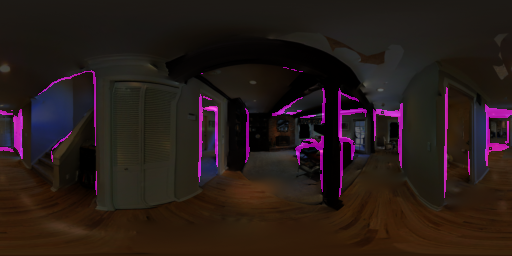
Where is `closet door`? The height and width of the screenshot is (256, 512). closet door is located at coordinates (155, 130).